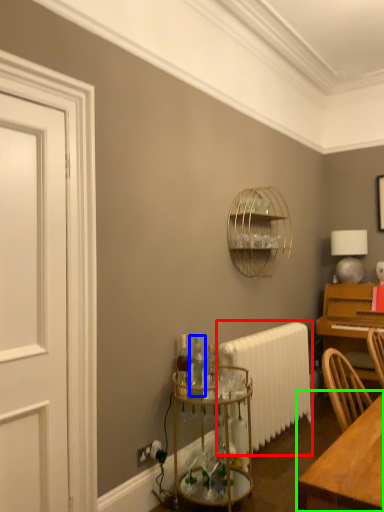
Question: Which is nearer to the radiator (highlighted by a red box)? bottle (highlighted by a blue box) or table (highlighted by a green box).

Choices:
 (A) bottle
 (B) table

Answer: (A)